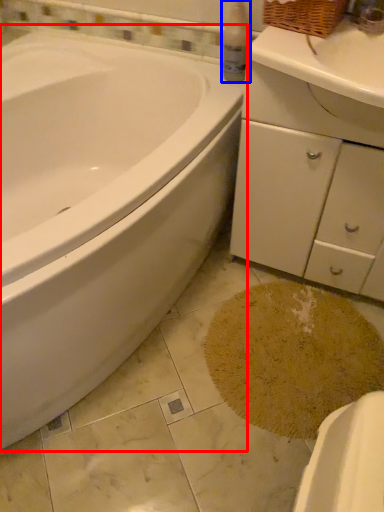
Question: Which point is further to the camera, bathtub (highlighted by a red box) or cleaning product (highlighted by a blue box)?

Choices:
 (A) bathtub
 (B) cleaning product

Answer: (B)